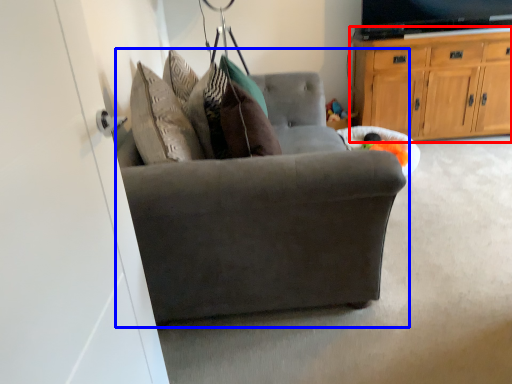
Question: Which of the following is the closest to the observer, cabinetry (highlighted by a red box) or chair (highlighted by a blue box)?

Choices:
 (A) cabinetry
 (B) chair

Answer: (B)